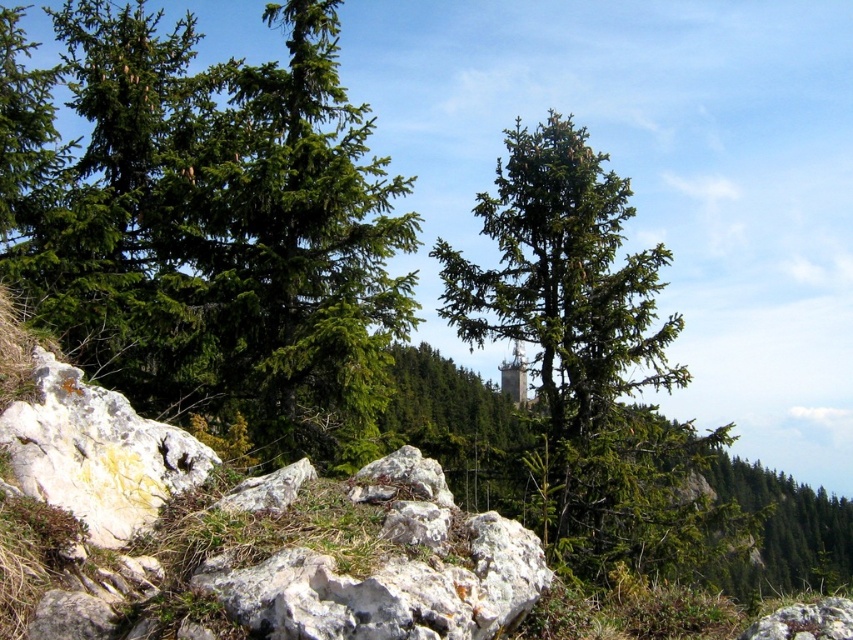
You are standing in the forest and see the green matte tree at left and the green matte tree at center. Which one is farther away from you?

The green matte tree at center is farther away because it is positioned behind the green matte tree at left.

You are standing at the center of the image. Which direction should you walk to reach the green matte tree at left?

You should walk to the left to reach the green matte tree at left since it is located at point (x=222, y=232), which is to the left of the center position.